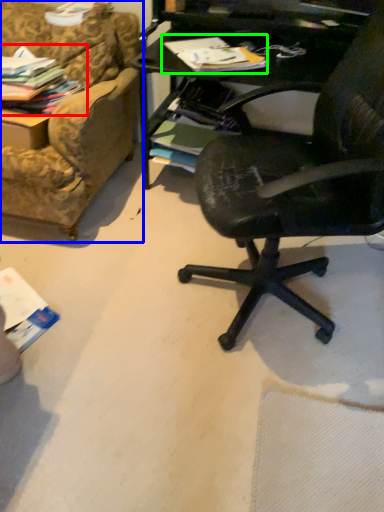
Question: Considering the real-world distances, which object is closest to magazine (highlighted by a red box)? studio couch (highlighted by a blue box) or magazine (highlighted by a green box).

Choices:
 (A) studio couch
 (B) magazine

Answer: (A)